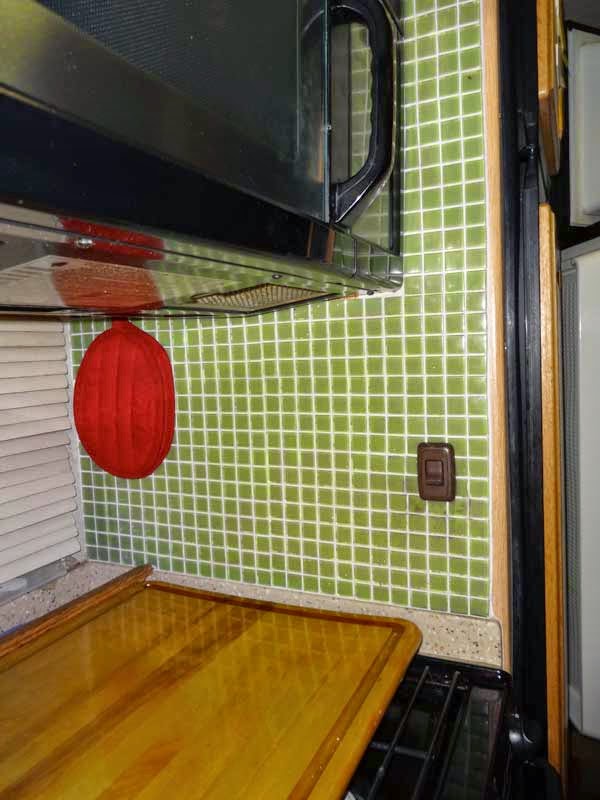
Locate an element on the screen. This screenshot has height=800, width=600. microwave vent is located at coordinates (264, 294).